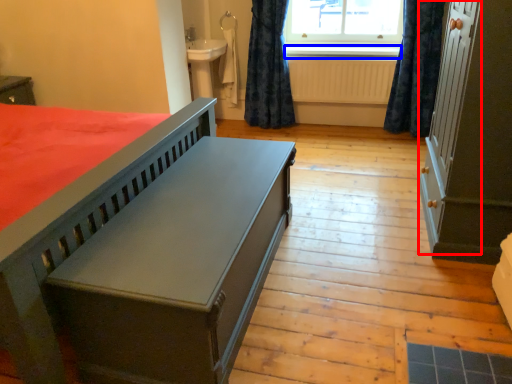
Question: Among these objects, which one is farthest to the camera, screen door (highlighted by a red box) or window sill (highlighted by a blue box)?

Choices:
 (A) screen door
 (B) window sill

Answer: (B)